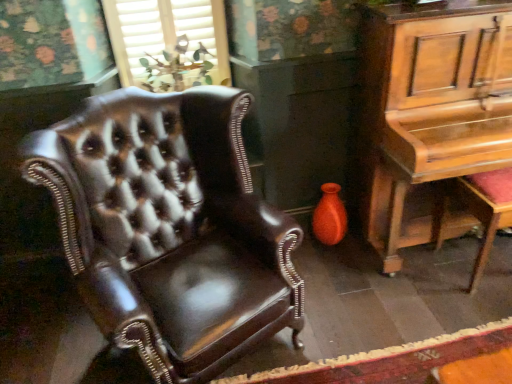
Question: In terms of width, does red cushioned stool at right look wider or thinner when compared to matte orange vase at lower right?

Choices:
 (A) wide
 (B) thin

Answer: (A)

Question: From a real-world perspective, is red cushioned stool at right positioned above or below matte orange vase at lower right?

Choices:
 (A) above
 (B) below

Answer: (A)

Question: Considering the real-world distances, which object is farthest from the wooden piano at right?

Choices:
 (A) shiny brown leather armchair at left
 (B) matte wood window at upper center
 (C) matte orange vase at lower right
 (D) red cushioned stool at right

Answer: (B)

Question: Which object is the farthest from the wooden piano at right?

Choices:
 (A) shiny brown leather armchair at left
 (B) matte wood window at upper center
 (C) red cushioned stool at right
 (D) matte orange vase at lower right

Answer: (B)